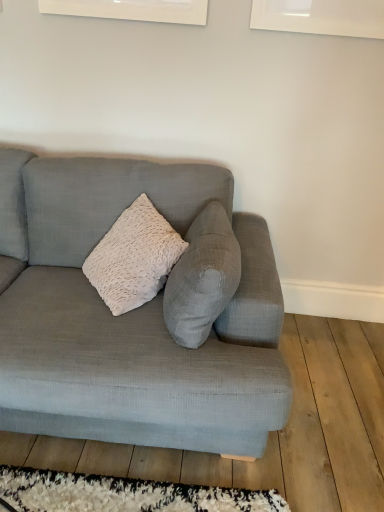
Find the location of a particular element. textured gray couch at center is located at coordinates (129, 315).

This screenshot has height=512, width=384. What do you see at coordinates (129, 315) in the screenshot? I see `textured gray couch at center` at bounding box center [129, 315].

You are a GUI agent. You are given a task and a screenshot of the screen. Output one action in this format:
    pyautogui.click(x=<x>, y=<y>)
    Task: Click on the white shaggy rug at lower center
    This screenshot has height=512, width=384.
    Given the screenshot: What is the action you would take?
    pyautogui.click(x=123, y=494)

Describe the element at coordinates (123, 494) in the screenshot. The height and width of the screenshot is (512, 384). I see `white shaggy rug at lower center` at that location.

You are a GUI agent. You are given a task and a screenshot of the screen. Output one action in this format:
    pyautogui.click(x=<x>, y=<y>)
    Task: Click on the textured gray couch at center
    
    Given the screenshot: What is the action you would take?
    pyautogui.click(x=129, y=315)

Visually, is white shaggy rug at lower center positioned to the left or to the right of textured gray couch at center?

white shaggy rug at lower center is to the right of textured gray couch at center.

Between white shaggy rug at lower center and textured gray couch at center, which one is positioned behind?

Positioned behind is white shaggy rug at lower center.

Which is in front, point (252, 499) or point (99, 352)?

Point (99, 352)

From the image's perspective, between white shaggy rug at lower center and textured gray couch at center, who is located below?

white shaggy rug at lower center.

Based on the photo, from a real-world perspective, is white shaggy rug at lower center above or below textured gray couch at center?

white shaggy rug at lower center is situated lower than textured gray couch at center in the real world.

Is white shaggy rug at lower center wider or thinner than textured gray couch at center?

white shaggy rug at lower center is thinner than textured gray couch at center.

Considering the sizes of objects white shaggy rug at lower center and textured gray couch at center in the image provided, who is taller, white shaggy rug at lower center or textured gray couch at center?

With more height is textured gray couch at center.

Who is bigger, white shaggy rug at lower center or textured gray couch at center?

textured gray couch at center is bigger.

Is textured gray couch at center completely or partially inside white shaggy rug at lower center?

No, textured gray couch at center is not surrounded by white shaggy rug at lower center.

Is white shaggy rug at lower center positioned far away from textured gray couch at center?

They are positioned close to each other.

Is white shaggy rug at lower center facing away from textured gray couch at center?

white shaggy rug at lower center does not have its back to textured gray couch at center.

How distant is white shaggy rug at lower center from textured gray couch at center?

white shaggy rug at lower center is 21.53 inches away from textured gray couch at center.

Identify the location of mat behind the textured gray couch at center. (123, 494).

Which is more to the right, textured gray couch at center or white shaggy rug at lower center?

white shaggy rug at lower center.

Between textured gray couch at center and white shaggy rug at lower center, which one is positioned behind?

white shaggy rug at lower center is further away from the camera.

Is point (59, 253) in front of point (173, 486)?

No, it is behind (173, 486).

From the image's perspective, which one is positioned lower, textured gray couch at center or white shaggy rug at lower center?

From the image's view, white shaggy rug at lower center is below.

From a real-world perspective, is textured gray couch at center positioned under white shaggy rug at lower center based on gravity?

No.

Between textured gray couch at center and white shaggy rug at lower center, which one has smaller width?

With smaller width is white shaggy rug at lower center.

Considering the sizes of textured gray couch at center and white shaggy rug at lower center in the image, is textured gray couch at center taller or shorter than white shaggy rug at lower center?

Clearly, textured gray couch at center is taller compared to white shaggy rug at lower center.

Who is smaller, textured gray couch at center or white shaggy rug at lower center?

white shaggy rug at lower center.

Is textured gray couch at center completely or partially outside of white shaggy rug at lower center?

That's correct, textured gray couch at center is outside of white shaggy rug at lower center.

Is textured gray couch at center directly adjacent to white shaggy rug at lower center?

textured gray couch at center and white shaggy rug at lower center are not in contact.

Is textured gray couch at center facing away from white shaggy rug at lower center?

No, textured gray couch at center's orientation is not away from white shaggy rug at lower center.

How different are the orientations of textured gray couch at center and white shaggy rug at lower center in degrees?

There is a 91-degree angle between the facing directions of textured gray couch at center and white shaggy rug at lower center.

Measure the distance from textured gray couch at center to white shaggy rug at lower center.

textured gray couch at center and white shaggy rug at lower center are 21.53 inches apart.

This screenshot has width=384, height=512. In order to click on studio couch located above the white shaggy rug at lower center (from a real-world perspective) in this screenshot , I will do `click(129, 315)`.

Image resolution: width=384 pixels, height=512 pixels. I want to click on studio couch in front of the white shaggy rug at lower center, so click(129, 315).

Locate an element on the screen. The height and width of the screenshot is (512, 384). mat that is on the right side of textured gray couch at center is located at coordinates (123, 494).